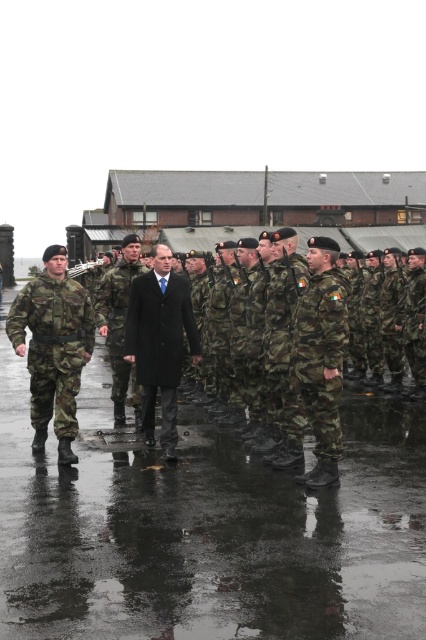
Question: Is dark wool coat at center smaller than camouflage fabric uniform at center?

Choices:
 (A) yes
 (B) no

Answer: (B)

Question: Can you confirm if camouflage fabric uniform at left is positioned to the left of camouflage uniform at center?

Choices:
 (A) yes
 (B) no

Answer: (A)

Question: Which object appears closest to the camera in this image?

Choices:
 (A) camouflage fabric uniform at center
 (B) wet asphalt at center
 (C) dark wool coat at center
 (D) camouflage uniform at center

Answer: (B)

Question: Which is farther from the dark wool coat at center?

Choices:
 (A) wet asphalt at center
 (B) camouflage fabric uniform at center
 (C) camouflage uniform at center

Answer: (A)

Question: Which point appears farthest from the camera in this image?

Choices:
 (A) (48, 401)
 (B) (121, 289)

Answer: (B)

Question: Is wet asphalt at center positioned before camouflage fabric uniform at left?

Choices:
 (A) yes
 (B) no

Answer: (A)